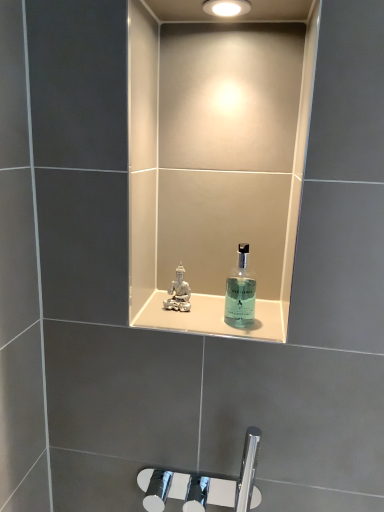
Question: Is transparent glass bottle at center wider or thinner than translucent glass shelf at center?

Choices:
 (A) thin
 (B) wide

Answer: (A)

Question: In the image, is transparent glass bottle at center positioned in front of or behind translucent glass shelf at center?

Choices:
 (A) behind
 (B) front

Answer: (B)

Question: Which of these objects is positioned closest to the matte white light fixture at upper center?

Choices:
 (A) transparent glass bottle at center
 (B) translucent glass shelf at center

Answer: (A)

Question: Which object is positioned farthest from the transparent glass bottle at center?

Choices:
 (A) translucent glass shelf at center
 (B) matte white light fixture at upper center

Answer: (B)